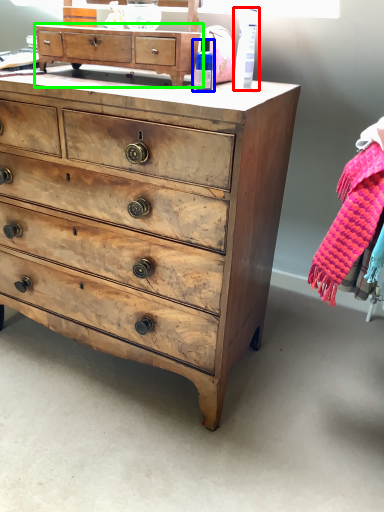
Question: Which object is the closest to the toiletry (highlighted by a red box)? Choose among these: toiletry (highlighted by a blue box) or chest of drawers (highlighted by a green box).

Choices:
 (A) toiletry
 (B) chest of drawers

Answer: (A)